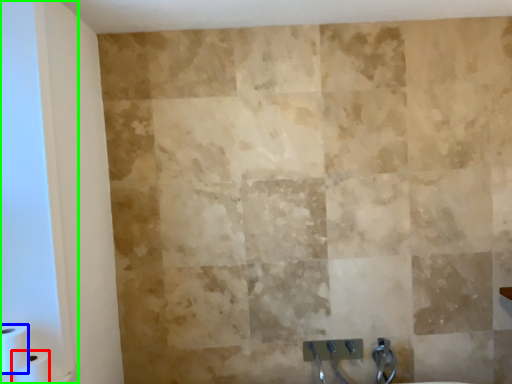
Question: Considering the real-world distances, which object is farthest from toilet paper (highlighted by a red box)? toilet paper (highlighted by a blue box) or glass door (highlighted by a green box)?

Choices:
 (A) toilet paper
 (B) glass door

Answer: (B)